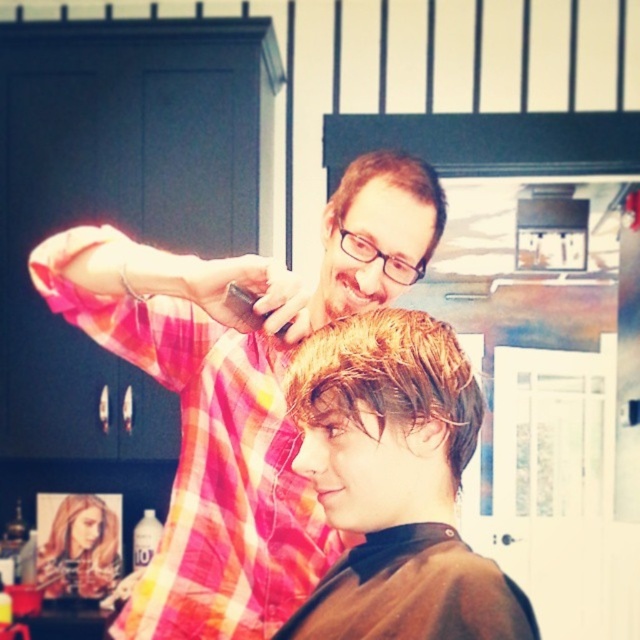
Question: Can you confirm if shiny blonde hair at center is positioned below matte black hair clipper at upper center?

Choices:
 (A) no
 (B) yes

Answer: (B)

Question: Can you confirm if shiny brown hair at center is positioned below matte black hair clipper at upper center?

Choices:
 (A) no
 (B) yes

Answer: (B)

Question: Does shiny blonde hair at center have a lesser width compared to blonde hair at upper left?

Choices:
 (A) no
 (B) yes

Answer: (B)

Question: Which of the following is the closest to the observer?

Choices:
 (A) matte black hair clipper at upper center
 (B) pink plaid shirt at upper left
 (C) blonde hair at upper left

Answer: (B)

Question: Which object is positioned closest to the shiny blonde hair at center?

Choices:
 (A) matte black hair clipper at upper center
 (B) pink plaid shirt at upper left
 (C) shiny brown hair at center

Answer: (C)

Question: Among these points, which one is farthest from the camera?

Choices:
 (A) (296, 355)
 (B) (65, 566)
 (C) (442, 417)

Answer: (B)